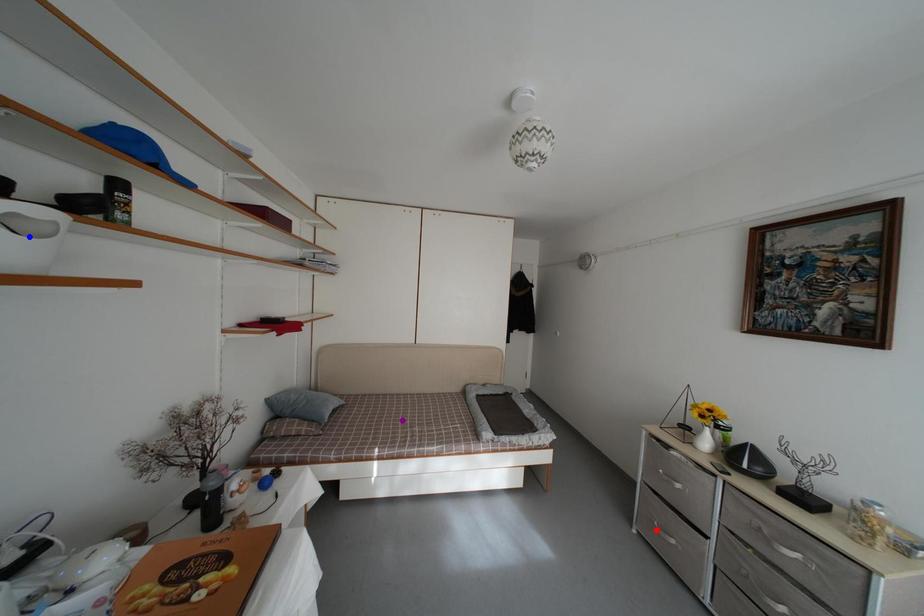
Order these from nearest to farthest:
red point | purple point | blue point

blue point, red point, purple point